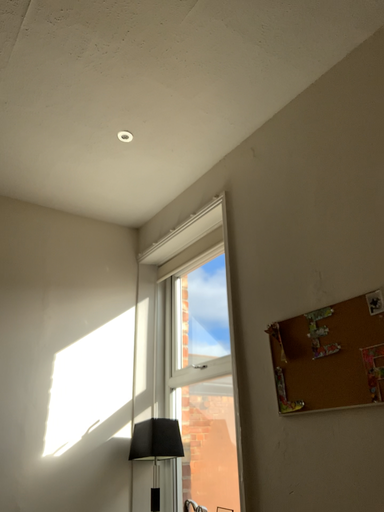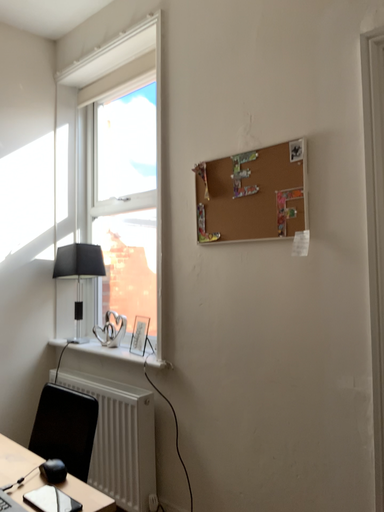
Question: Which way did the camera rotate in the video?

Choices:
 (A) rotated left
 (B) rotated right

Answer: (B)